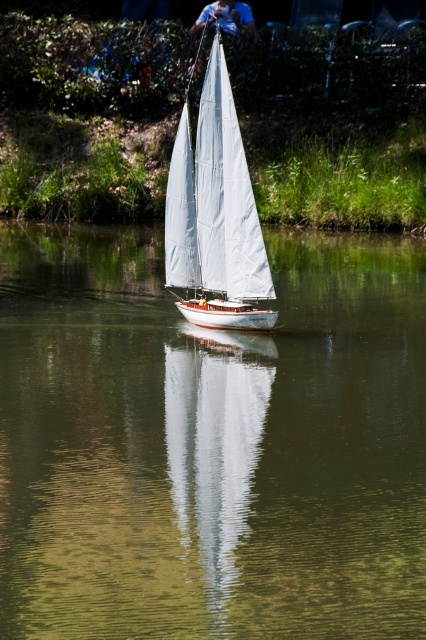
Between green reflective water at center and white canvas sailboat at center, which one is positioned higher?

white canvas sailboat at center is above.

Is point (75, 552) farther from viewer compared to point (203, 148)?

No, (75, 552) is in front of (203, 148).

Where is `green reflective water at center`? This screenshot has height=640, width=426. green reflective water at center is located at coordinates point(210,444).